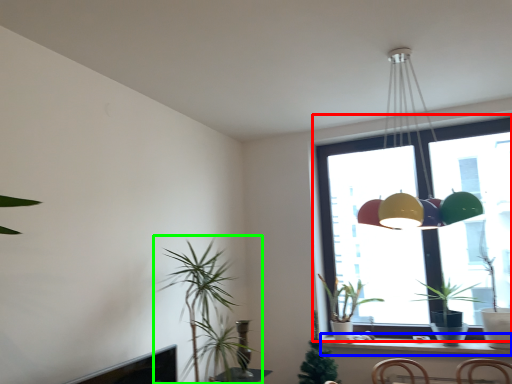
Question: Considering the real-world distances, which object is closest to window (highlighted by a red box)? window sill (highlighted by a blue box) or houseplant (highlighted by a green box).

Choices:
 (A) window sill
 (B) houseplant

Answer: (A)